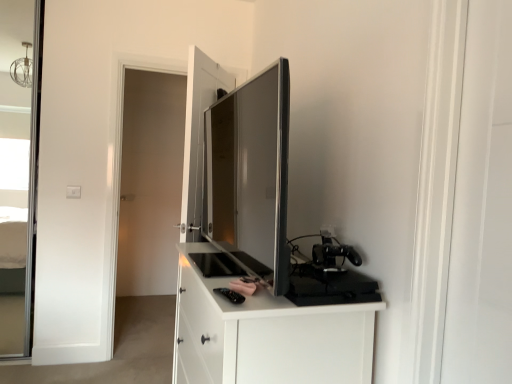
Question: From the image's perspective, is white matte cabinet at center located above or below white glossy screen door at right, the 2th screen door in the back-to-front sequence?

Choices:
 (A) below
 (B) above

Answer: (A)

Question: Is point (309, 380) positioned closer to the camera than point (509, 51)?

Choices:
 (A) closer
 (B) farther

Answer: (B)

Question: Which object is the farthest from the transparent glass door at left, the 1th screen door viewed from the back?

Choices:
 (A) white glossy screen door at right, placed as the first screen door when sorted from front to back
 (B) black matte gaming console at right, arranged as the 1th appliance when ordered from the bottom
 (C) matte black tv at center, which is counted as the 1th appliance, starting from the top
 (D) white matte cabinet at center

Answer: (A)

Question: Which object is positioned closest to the matte black tv at center, the second appliance when ordered from bottom to top?

Choices:
 (A) black matte gaming console at right, the 1th appliance viewed from the right
 (B) white matte cabinet at center
 (C) white glossy screen door at right, which is counted as the first screen door, starting from the right
 (D) transparent glass door at left, which is the 2th screen door in right-to-left order

Answer: (B)